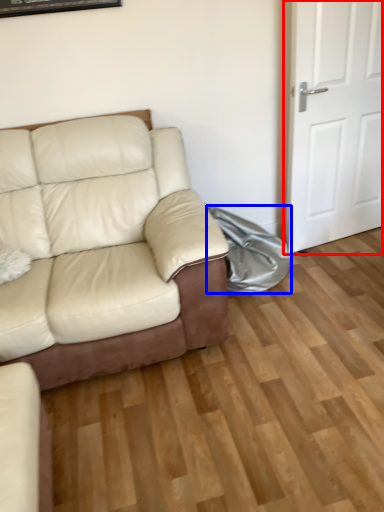
Question: Which object appears closest to the camera in this image, door (highlighted by a red box) or material (highlighted by a blue box)?

Choices:
 (A) door
 (B) material

Answer: (A)